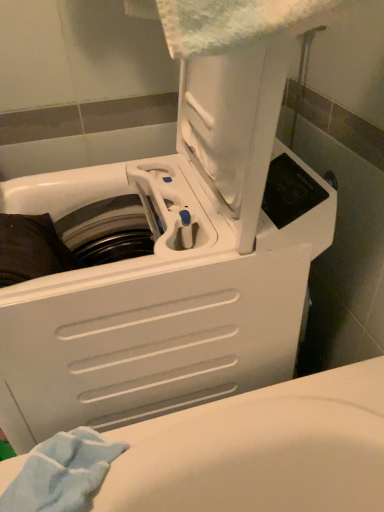
Locate an element on the screen. Image resolution: width=384 pixels, height=512 pixels. light blue soft towel at lower left is located at coordinates (61, 472).

The image size is (384, 512). What do you see at coordinates (61, 472) in the screenshot?
I see `light blue soft towel at lower left` at bounding box center [61, 472].

Describe the element at coordinates (171, 265) in the screenshot. I see `white plastic washing machine at center` at that location.

Image resolution: width=384 pixels, height=512 pixels. I want to click on white plastic washing machine at center, so coord(171,265).

The image size is (384, 512). Identify the location of light blue soft towel at lower left. (61, 472).

Does light blue soft towel at lower left appear on the right side of white plastic washing machine at center?

In fact, light blue soft towel at lower left is to the left of white plastic washing machine at center.

Considering the positions of objects light blue soft towel at lower left and white plastic washing machine at center in the image provided, who is behind, light blue soft towel at lower left or white plastic washing machine at center?

light blue soft towel at lower left is further from the camera.

Is point (100, 482) positioned before point (249, 371)?

Yes, point (100, 482) is in front of point (249, 371).

From the image's perspective, is light blue soft towel at lower left located above or below white plastic washing machine at center?

Clearly, from the image's perspective, light blue soft towel at lower left is below white plastic washing machine at center.

From a real-world perspective, which object stands above the other?

From a 3D spatial view, white plastic washing machine at center is above.

Can you confirm if light blue soft towel at lower left is wider than white plastic washing machine at center?

In fact, light blue soft towel at lower left might be narrower than white plastic washing machine at center.

Which of these two, light blue soft towel at lower left or white plastic washing machine at center, stands shorter?

Result: light blue soft towel at lower left.

Between light blue soft towel at lower left and white plastic washing machine at center, which one has smaller size?

light blue soft towel at lower left is smaller.

Would you say light blue soft towel at lower left is outside white plastic washing machine at center?

Yes, light blue soft towel at lower left is located beyond the bounds of white plastic washing machine at center.

Is light blue soft towel at lower left next to white plastic washing machine at center and touching it?

No.

From the picture: Is light blue soft towel at lower left aimed at white plastic washing machine at center?

No, light blue soft towel at lower left is not aimed at white plastic washing machine at center.

How different are the orientations of light blue soft towel at lower left and white plastic washing machine at center in degrees?

light blue soft towel at lower left and white plastic washing machine at center are facing 3.42 degrees away from each other.

At what (x,y) coordinates should I click in order to perform the action: click on bath towel located below the white plastic washing machine at center (from the image's perspective). Please return your answer as a coordinate pair (x, y). The height and width of the screenshot is (512, 384). Looking at the image, I should click on (61, 472).

Is white plastic washing machine at center to the left or to the right of light blue soft towel at lower left in the image?

In the image, white plastic washing machine at center appears on the right side of light blue soft towel at lower left.

Between white plastic washing machine at center and light blue soft towel at lower left, which one is positioned behind?

light blue soft towel at lower left is further from the camera.

Does point (117, 354) lie in front of point (50, 447)?

No, (117, 354) is behind (50, 447).

From the image's perspective, which is above, white plastic washing machine at center or light blue soft towel at lower left?

From the image's view, white plastic washing machine at center is above.

From a real-world perspective, which object rests below the other?

light blue soft towel at lower left is physically lower.

Is white plastic washing machine at center wider than light blue soft towel at lower left?

Correct, the width of white plastic washing machine at center exceeds that of light blue soft towel at lower left.

Considering the relative sizes of white plastic washing machine at center and light blue soft towel at lower left in the image provided, is white plastic washing machine at center taller than light blue soft towel at lower left?

Indeed, white plastic washing machine at center has a greater height compared to light blue soft towel at lower left.

Does white plastic washing machine at center have a smaller size compared to light blue soft towel at lower left?

Incorrect, white plastic washing machine at center is not smaller in size than light blue soft towel at lower left.

From the picture: Would you say white plastic washing machine at center is outside light blue soft towel at lower left?

Yes, white plastic washing machine at center is outside of light blue soft towel at lower left.

Is white plastic washing machine at center with light blue soft towel at lower left?

No, white plastic washing machine at center is not touching light blue soft towel at lower left.

Could you tell me if white plastic washing machine at center is facing light blue soft towel at lower left?

No, white plastic washing machine at center is not oriented towards light blue soft towel at lower left.

Consider the image. How different are the orientations of white plastic washing machine at center and light blue soft towel at lower left in degrees?

The angular difference between white plastic washing machine at center and light blue soft towel at lower left is 3.42 degrees.

Measure the distance between white plastic washing machine at center and light blue soft towel at lower left.

They are 12.25 inches apart.

The height and width of the screenshot is (512, 384). In order to click on washing machine that is above the light blue soft towel at lower left (from a real-world perspective) in this screenshot , I will do `click(171, 265)`.

There is a light blue soft towel at lower left. Where is `washing machine above it (from a real-world perspective)`? The height and width of the screenshot is (512, 384). washing machine above it (from a real-world perspective) is located at coordinates (171, 265).

Identify the location of bath towel lying on the left of white plastic washing machine at center. The image size is (384, 512). (61, 472).